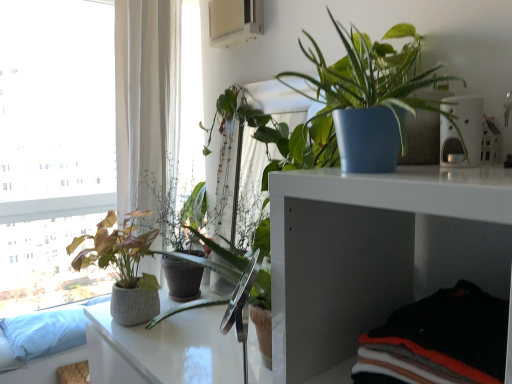
Identify the location of empty space that is ontop of white glossy table at center (from a real-world perspective). The image size is (512, 384). (187, 331).